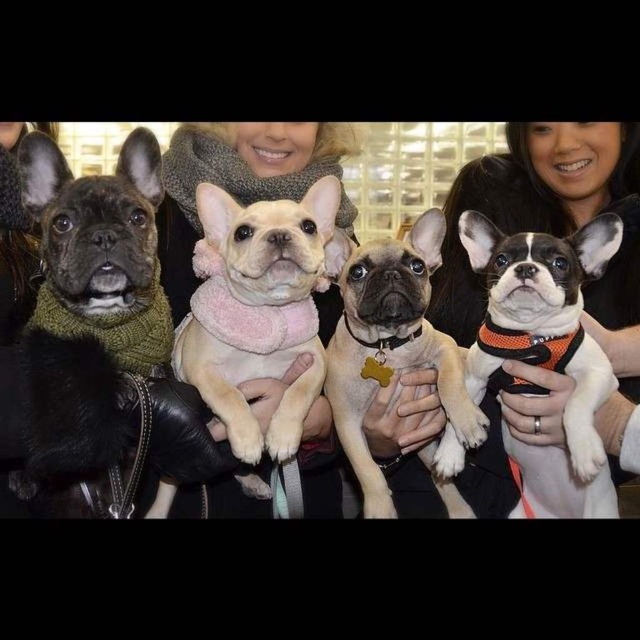
Question: Which object appears farthest from the camera in this image?

Choices:
 (A) light beige fur at center
 (B) white and black fur at right
 (C) matte black dog at left
 (D) peachy fleece dog at center

Answer: (A)

Question: Which object is closer to the camera taking this photo?

Choices:
 (A) matte black dog at left
 (B) white and black fur at right
 (C) peachy fleece dog at center
 (D) light beige fur at center

Answer: (A)

Question: Observing the image, what is the correct spatial positioning of matte black dog at left in reference to white and black fur at right?

Choices:
 (A) below
 (B) above

Answer: (B)

Question: Considering the relative positions of peachy fleece dog at center and light beige fur at center in the image provided, where is peachy fleece dog at center located with respect to light beige fur at center?

Choices:
 (A) left
 (B) right

Answer: (A)

Question: Which of the following is the farthest from the observer?

Choices:
 (A) light beige fur at center
 (B) white and black fur at right

Answer: (A)

Question: Does matte black dog at left appear on the left side of light beige fur at center?

Choices:
 (A) no
 (B) yes

Answer: (B)